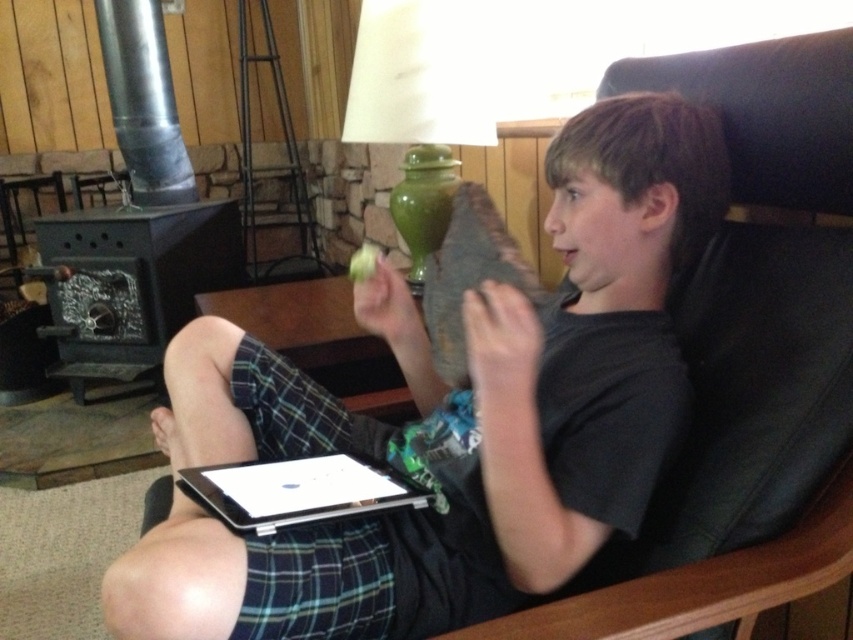
Is black matte shirt at center bigger than silver metallic laptop at lower center?

Yes, black matte shirt at center is bigger than silver metallic laptop at lower center.

Who is higher up, black matte shirt at center or silver metallic laptop at lower center?

black matte shirt at center is higher up.

Find the location of a particular element. This screenshot has width=853, height=640. black matte shirt at center is located at coordinates (453, 419).

Find the location of a particular element. This screenshot has width=853, height=640. black matte shirt at center is located at coordinates (453, 419).

Identify the location of black matte shirt at center. The height and width of the screenshot is (640, 853). (453, 419).

Based on the photo, measure the distance from black matte shirt at center to green ceramic lamp at upper center.

The distance of black matte shirt at center from green ceramic lamp at upper center is 29.29 inches.

Locate an element on the screen. black matte shirt at center is located at coordinates pyautogui.click(x=453, y=419).

The width and height of the screenshot is (853, 640). In order to click on black matte shirt at center in this screenshot , I will do `click(453, 419)`.

Is green ceramic lamp at upper center behind silver metallic laptop at lower center?

Yes, it is behind silver metallic laptop at lower center.

The height and width of the screenshot is (640, 853). What do you see at coordinates (421, 104) in the screenshot? I see `green ceramic lamp at upper center` at bounding box center [421, 104].

Is point (440, 237) behind point (253, 484)?

Yes, point (440, 237) is farther from viewer.

You are a GUI agent. You are given a task and a screenshot of the screen. Output one action in this format:
    pyautogui.click(x=<x>, y=<y>)
    Task: Click on the green ceramic lamp at upper center
    This screenshot has height=640, width=853.
    Given the screenshot: What is the action you would take?
    pyautogui.click(x=421, y=104)